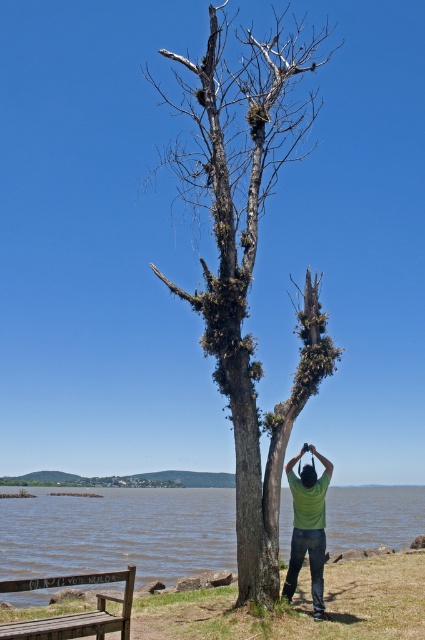
Question: Estimate the real-world distances between objects in this image. Which object is farther from the brown water at lower center?

Choices:
 (A) green matte shirt at center
 (B) wooden bench at lower left
 (C) dead wood tree at center

Answer: (B)

Question: Which object appears closest to the camera in this image?

Choices:
 (A) green matte head at center
 (B) dead wood tree at center
 (C) brown water at lower center

Answer: (C)

Question: Is brown water at lower center bigger than wooden bench at lower left?

Choices:
 (A) no
 (B) yes

Answer: (B)

Question: Is dead wood tree at center further to camera compared to brown water at lower center?

Choices:
 (A) no
 (B) yes

Answer: (B)

Question: Can you confirm if green matte shirt at center is thinner than green matte head at center?

Choices:
 (A) yes
 (B) no

Answer: (B)

Question: Which of the following is the closest to the observer?

Choices:
 (A) (320, 612)
 (B) (295, 152)
 (C) (14, 588)

Answer: (C)